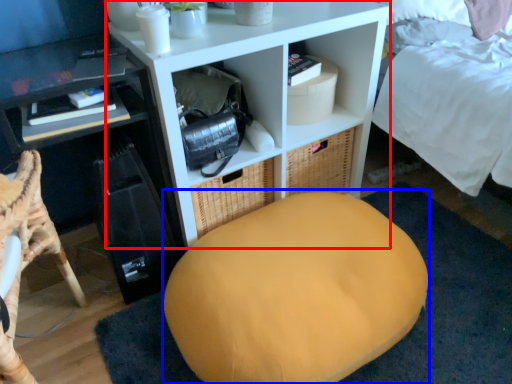
Question: Which object appears farthest to the camera in this image, shelf (highlighted by a red box) or bean bag chair (highlighted by a blue box)?

Choices:
 (A) shelf
 (B) bean bag chair

Answer: (A)